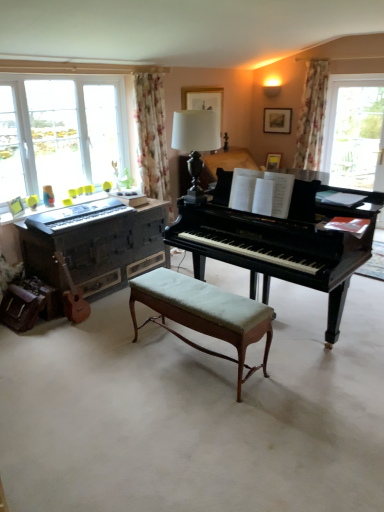
Locate an element on the screen. Image resolution: width=384 pixels, height=512 pixels. vacant area that lies to the right of light green upholstered bench at center is located at coordinates (299, 367).